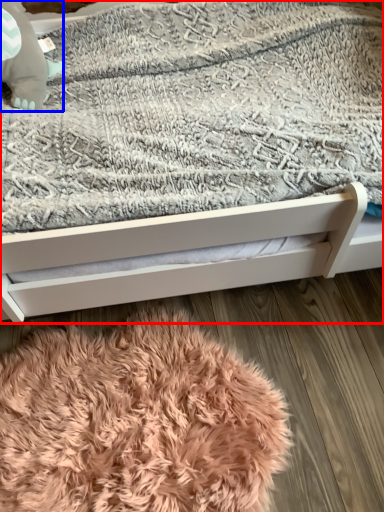
Question: Which of the following is the closest to the observer, bed (highlighted by a red box) or baby elephant (highlighted by a blue box)?

Choices:
 (A) bed
 (B) baby elephant

Answer: (A)